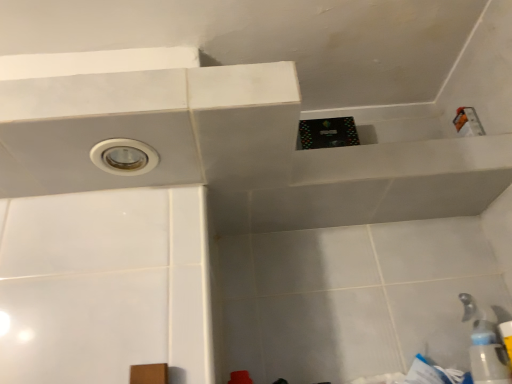
Question: Looking at their shapes, would you say white plastic faucet at lower right is wider or thinner than white plastic hole at upper left?

Choices:
 (A) thin
 (B) wide

Answer: (A)

Question: Is white plastic faucet at lower right situated inside white plastic hole at upper left or outside?

Choices:
 (A) inside
 (B) outside

Answer: (B)

Question: Estimate the real-world distances between objects in this image. Which object is closer to the transparent plastic bottle at lower right?

Choices:
 (A) white plastic hole at upper left
 (B) white plastic faucet at lower right

Answer: (B)

Question: Estimate the real-world distances between objects in this image. Which object is closer to the transparent plastic bottle at lower right?

Choices:
 (A) white plastic faucet at lower right
 (B) white plastic hole at upper left

Answer: (A)